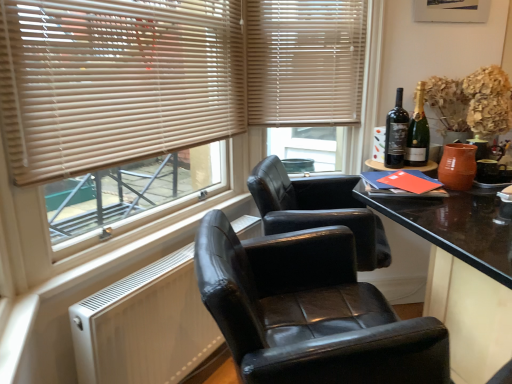
Question: From a real-world perspective, is beige wood blinds at upper center positioned under black leather chair at center based on gravity?

Choices:
 (A) no
 (B) yes

Answer: (A)

Question: Considering the relative sizes of beige wood blinds at upper center and black leather chair at center in the image provided, is beige wood blinds at upper center wider than black leather chair at center?

Choices:
 (A) no
 (B) yes

Answer: (A)

Question: Is beige wood blinds at upper center turned away from black leather chair at center?

Choices:
 (A) no
 (B) yes

Answer: (A)

Question: From the image's perspective, is beige wood blinds at upper center located above black leather chair at center?

Choices:
 (A) yes
 (B) no

Answer: (A)

Question: Is there a large distance between beige wood blinds at upper center and black leather chair at center?

Choices:
 (A) no
 (B) yes

Answer: (B)

Question: From the image's perspective, is beige wood blinds at upper center beneath black leather chair at center?

Choices:
 (A) yes
 (B) no

Answer: (B)

Question: Can you confirm if beige wood blinds at upper left is wider than black leather chair at center?

Choices:
 (A) no
 (B) yes

Answer: (A)

Question: Considering the relative sizes of beige wood blinds at upper left and black leather chair at center in the image provided, is beige wood blinds at upper left shorter than black leather chair at center?

Choices:
 (A) no
 (B) yes

Answer: (A)

Question: Are beige wood blinds at upper left and black leather chair at center located far from each other?

Choices:
 (A) no
 (B) yes

Answer: (A)

Question: Does beige wood blinds at upper left appear on the left side of black leather chair at center?

Choices:
 (A) no
 (B) yes

Answer: (B)

Question: Is beige wood blinds at upper left looking in the opposite direction of black leather chair at center?

Choices:
 (A) yes
 (B) no

Answer: (B)

Question: Does beige wood blinds at upper left lie behind black leather chair at center?

Choices:
 (A) no
 (B) yes

Answer: (B)

Question: Considering the relative positions of black leather chair at center and black glass bottle at upper right, placed as the 2th bottle when sorted from right to left, in the image provided, is black leather chair at center to the left of black glass bottle at upper right, placed as the 2th bottle when sorted from right to left, from the viewer's perspective?

Choices:
 (A) yes
 (B) no

Answer: (A)